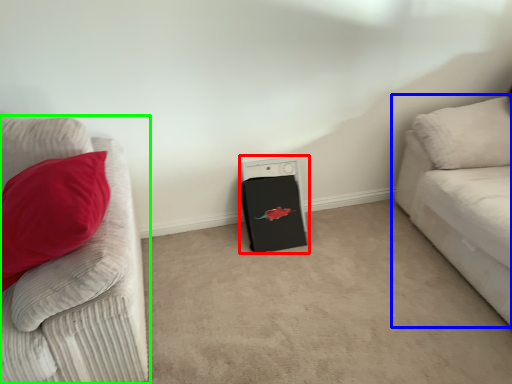
Question: Based on their relative distances, which object is farther from appliance (highlighted by a red box)? Choose from studio couch (highlighted by a blue box) and studio couch (highlighted by a green box).

Choices:
 (A) studio couch
 (B) studio couch

Answer: (B)